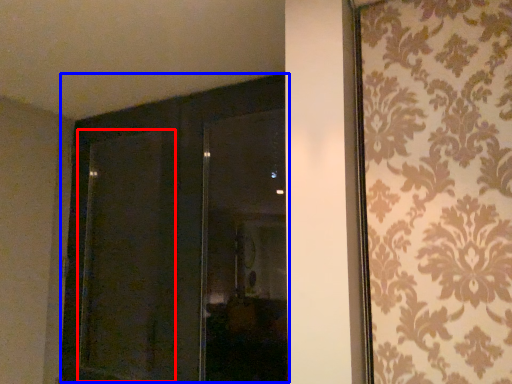
Question: Which object is further to the camera taking this photo, screen door (highlighted by a red box) or door (highlighted by a blue box)?

Choices:
 (A) screen door
 (B) door

Answer: (A)